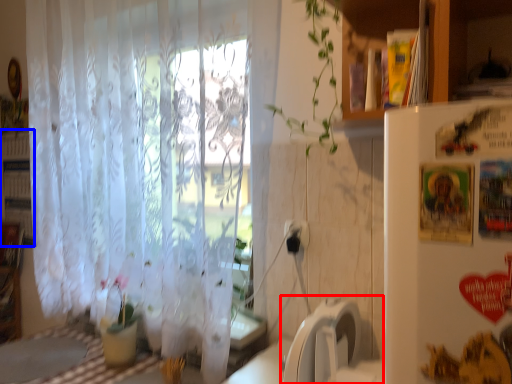
Question: Which object is closer to the camera taking this photo, washing machine (highlighted by a red box) or bookshelf (highlighted by a blue box)?

Choices:
 (A) washing machine
 (B) bookshelf

Answer: (A)